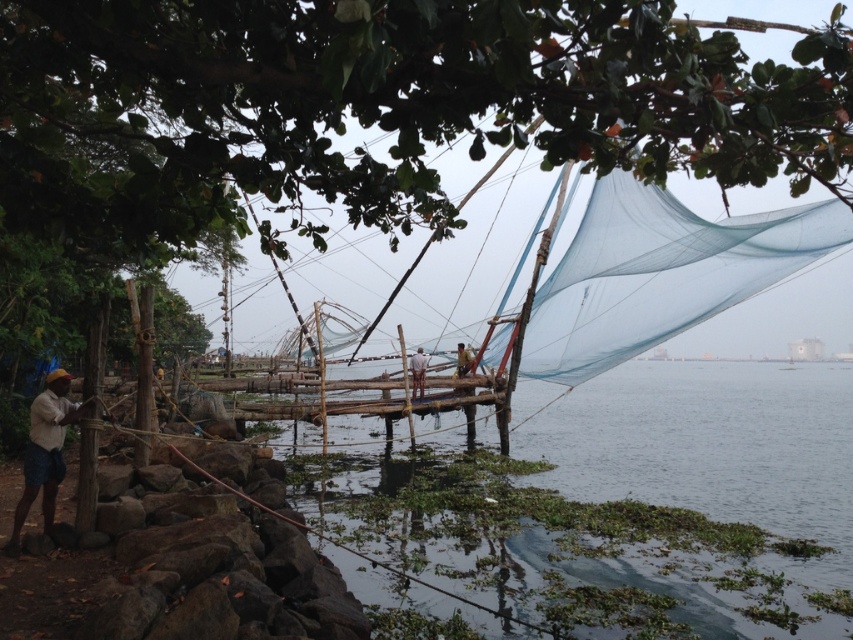
Question: Estimate the real-world distances between objects in this image. Which object is closer to the matte yellow cap at lower left?

Choices:
 (A) white fabric fisherman at center
 (B) green leafy tree at upper center
 (C) clear water at center

Answer: (B)

Question: Which point is farther to the camera?

Choices:
 (A) clear water at center
 (B) green leafy tree at upper center

Answer: (A)

Question: Which point is farther to the camera?

Choices:
 (A) matte yellow cap at lower left
 (B) white fabric fisherman at center
 (C) clear water at center

Answer: (B)

Question: Does green leafy tree at upper center have a lesser width compared to clear water at center?

Choices:
 (A) yes
 (B) no

Answer: (A)

Question: Is green leafy tree at upper center smaller than clear water at center?

Choices:
 (A) no
 (B) yes

Answer: (B)

Question: From the image, what is the correct spatial relationship of clear water at center in relation to matte yellow cap at lower left?

Choices:
 (A) above
 (B) below

Answer: (B)